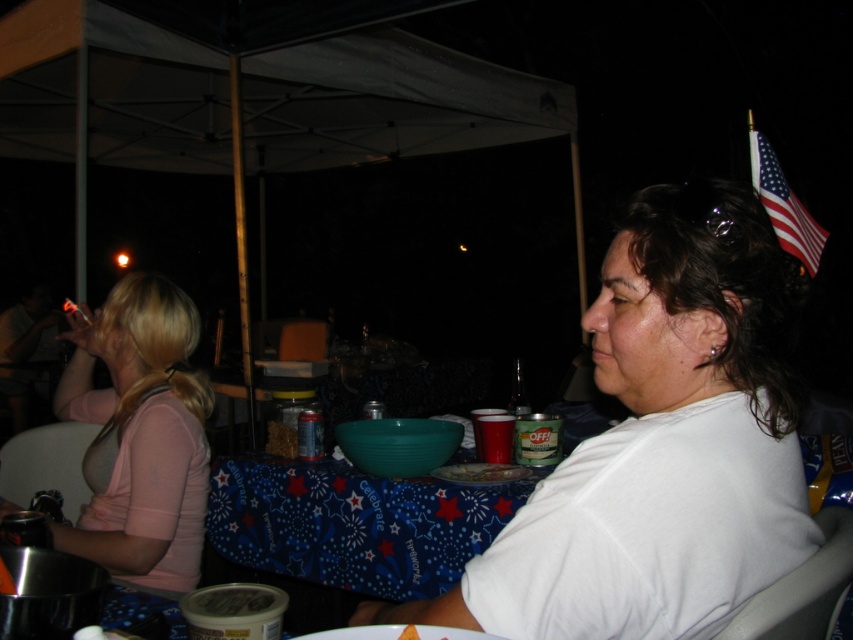
Is point (154, 296) less distant than point (405, 630)?

No, it is not.

Image resolution: width=853 pixels, height=640 pixels. In order to click on pink fabric shirt at left in this screenshot , I will do `click(140, 435)`.

Which is below, white matte shirt at center or pink fabric shirt at left?

pink fabric shirt at left is lower down.

From the picture: Who is positioned more to the left, white matte shirt at center or pink fabric shirt at left?

pink fabric shirt at left is more to the left.

Identify the location of white matte shirt at center. This screenshot has width=853, height=640. [659, 445].

Is blue fabric table at center below american flag at upper right?

Yes.

From the picture: Between blue fabric table at center and american flag at upper right, which one has less height?

Standing shorter between the two is blue fabric table at center.

This screenshot has width=853, height=640. What are the coordinates of `blue fabric table at center` in the screenshot? It's located at pyautogui.click(x=354, y=524).

You are a GUI agent. You are given a task and a screenshot of the screen. Output one action in this format:
    pyautogui.click(x=<x>, y=<y>)
    Task: Click on the blue fabric table at center
    Image resolution: width=853 pixels, height=640 pixels.
    Given the screenshot: What is the action you would take?
    pyautogui.click(x=354, y=524)